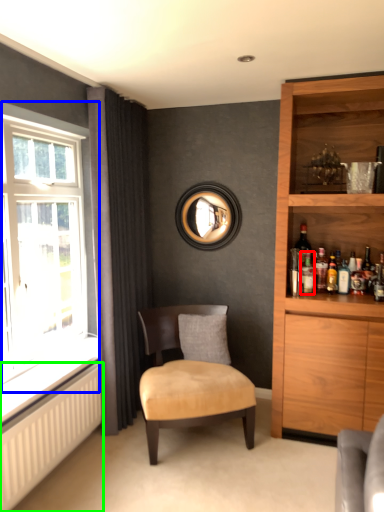
Question: Which is nearer to the bottle (highlighted by a red box)? window (highlighted by a blue box) or radiator (highlighted by a green box).

Choices:
 (A) window
 (B) radiator

Answer: (A)